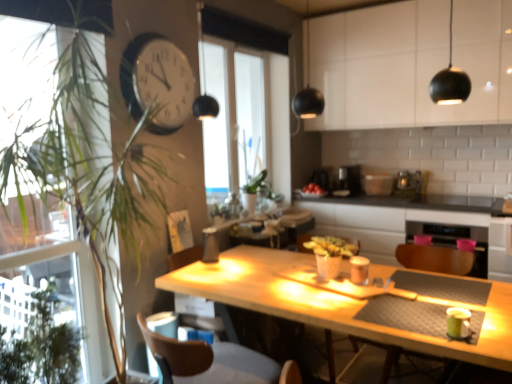
Question: Does green leafy plant at left have a larger size compared to satin silver toaster at center, arranged as the 1th appliance when viewed from the right?

Choices:
 (A) no
 (B) yes

Answer: (B)

Question: Can you see green leafy plant at left touching satin silver toaster at center, marked as the second appliance in a left-to-right arrangement?

Choices:
 (A) yes
 (B) no

Answer: (B)

Question: Does green leafy plant at left have a greater width compared to satin silver toaster at center, arranged as the 1th appliance when viewed from the right?

Choices:
 (A) no
 (B) yes

Answer: (B)

Question: Is green leafy plant at left closer to camera compared to satin silver toaster at center, arranged as the 1th appliance when viewed from the right?

Choices:
 (A) yes
 (B) no

Answer: (A)

Question: Is satin silver toaster at center, marked as the second appliance in a left-to-right arrangement, completely or partially inside green leafy plant at left?

Choices:
 (A) no
 (B) yes

Answer: (A)

Question: Do you think brown leather swivel chair at lower left is within white glossy clock at upper center, or outside of it?

Choices:
 (A) outside
 (B) inside

Answer: (A)

Question: From the image's perspective, is brown leather swivel chair at lower left positioned above or below white glossy clock at upper center?

Choices:
 (A) above
 (B) below

Answer: (B)

Question: Is point (223, 349) closer or farther from the camera than point (162, 132)?

Choices:
 (A) closer
 (B) farther

Answer: (A)

Question: Relative to white glossy clock at upper center, is brown leather swivel chair at lower left in front or behind?

Choices:
 (A) front
 (B) behind

Answer: (A)

Question: Considering the relative positions of white glossy cabinet at upper center and black plastic coffee maker at center, which is the first appliance from left to right, in the image provided, is white glossy cabinet at upper center to the left or to the right of black plastic coffee maker at center, which is the first appliance from left to right,?

Choices:
 (A) left
 (B) right

Answer: (B)

Question: Is white glossy cabinet at upper center wider or thinner than black plastic coffee maker at center, which is the first appliance from left to right?

Choices:
 (A) thin
 (B) wide

Answer: (A)

Question: From the image's perspective, is white glossy cabinet at upper center positioned above or below black plastic coffee maker at center, acting as the 2th appliance starting from the right?

Choices:
 (A) below
 (B) above

Answer: (B)

Question: Is white glossy cabinet at upper center situated inside black plastic coffee maker at center, acting as the 2th appliance starting from the right, or outside?

Choices:
 (A) outside
 (B) inside

Answer: (A)

Question: In terms of height, does transparent glass window at center look taller or shorter compared to green leafy plant at left?

Choices:
 (A) short
 (B) tall

Answer: (B)

Question: From a real-world perspective, relative to green leafy plant at left, is transparent glass window at center vertically above or below?

Choices:
 (A) below
 (B) above

Answer: (B)